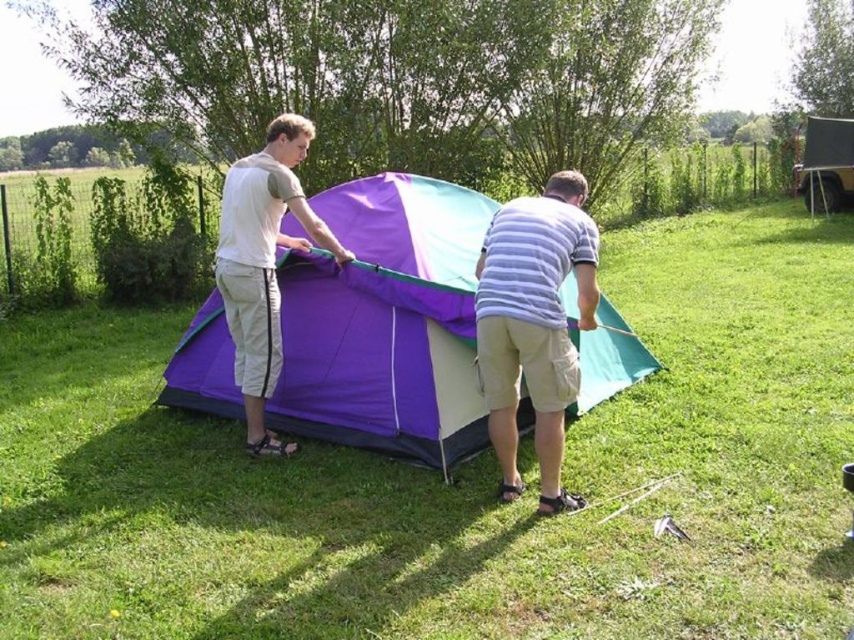
You are planning to place a picnic blanket near the purple fabric tent at center. If you want to set it 1 meter to the northeast of the tent, where should you place it?

The purple fabric tent at center is located at point (385, 323). To place the picnic blanket 1 meter to the northeast, you would need to calculate the coordinates based on the image dimensions and scale, but since exact measurements aren